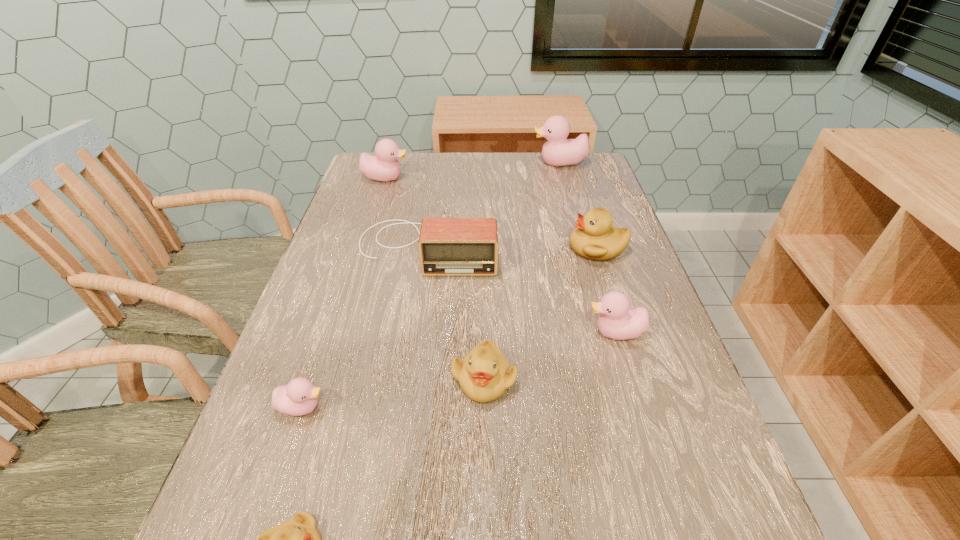
Where is `vacant region located on the front-facing side of the third biggest pink duckling`? The height and width of the screenshot is (540, 960). vacant region located on the front-facing side of the third biggest pink duckling is located at coordinates (552, 333).

Where is `vacant region located 0.100m on the front-facing side of the third biggest pink duckling`? The width and height of the screenshot is (960, 540). vacant region located 0.100m on the front-facing side of the third biggest pink duckling is located at coordinates (538, 333).

Find the location of a particular element. The height and width of the screenshot is (540, 960). vacant space situated 0.150m on the front-facing side of the fourth duckling from left to right is located at coordinates (485, 494).

Locate an element on the screen. The image size is (960, 540). blank area located on the front-facing side of the smallest pink duckling is located at coordinates (408, 407).

Find the location of `radio receiver located at the left edge`. radio receiver located at the left edge is located at coordinates (447, 246).

I want to click on object situated at the far left corner, so click(x=385, y=167).

What are the coordinates of `object that is at the far right corner` in the screenshot? It's located at (558, 151).

The height and width of the screenshot is (540, 960). Identify the location of free location at the far edge. (448, 158).

Image resolution: width=960 pixels, height=540 pixels. Find the location of `vacant space at the left edge of the desktop`. vacant space at the left edge of the desktop is located at coordinates (368, 322).

I want to click on blank space at the right edge of the desktop, so click(x=574, y=212).